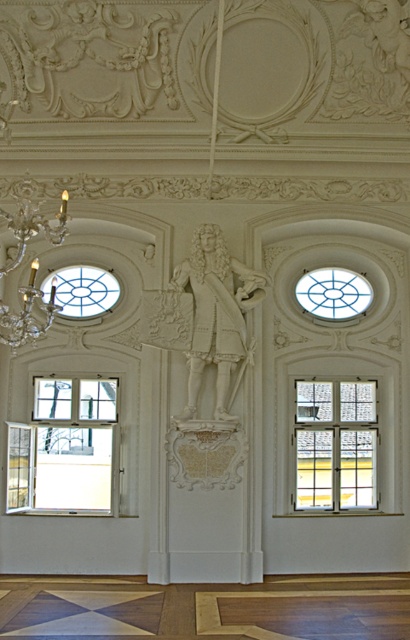
Who is positioned more to the left, white wooden window at center or clear glass window at upper center?

white wooden window at center

Does white wooden window at center appear on the left side of clear glass window at upper center?

Indeed, white wooden window at center is positioned on the left side of clear glass window at upper center.

Where is `white wooden window at center`? white wooden window at center is located at coordinates (336, 444).

Locate an element on the screen. white wooden window at center is located at coordinates (336, 444).

What do you see at coordinates (209, 314) in the screenshot? I see `white marble statue at center` at bounding box center [209, 314].

Between white marble statue at center and clear glass window at upper left, which one is positioned higher?

clear glass window at upper left is above.

Is point (177, 344) less distant than point (77, 273)?

Yes, point (177, 344) is closer to viewer.

What are the coordinates of `white marble statue at center` in the screenshot? It's located at (209, 314).

Which is more to the right, clear glass window at lower left or white marble statue at center?

white marble statue at center

Can you confirm if clear glass window at lower left is taller than white marble statue at center?

No.

Image resolution: width=410 pixels, height=640 pixels. I want to click on clear glass window at lower left, so (63, 449).

This screenshot has height=640, width=410. What are the coordinates of `clear glass window at lower left` in the screenshot? It's located at [63, 449].